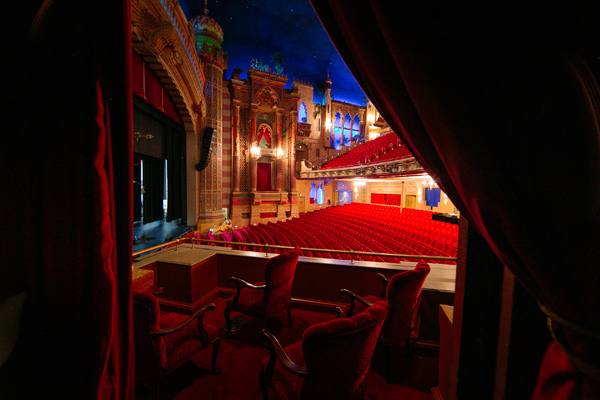
Where is `chair arms`? This screenshot has width=600, height=400. chair arms is located at coordinates (187, 318), (239, 283), (354, 295), (339, 308), (269, 335), (384, 276), (158, 290).